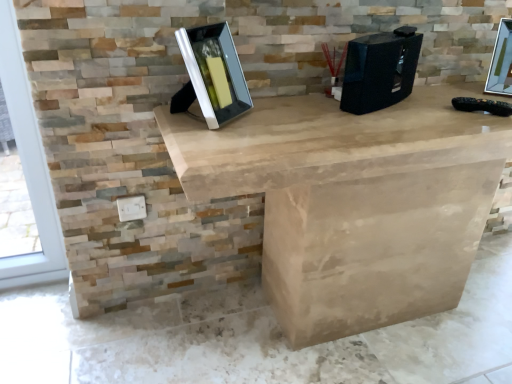
Question: Are metallic silver picture frame at upper right, the first picture frame when ordered from back to front, and matte black picture frame at center, which is counted as the first picture frame, starting from the left, far apart?

Choices:
 (A) no
 (B) yes

Answer: (A)

Question: Considering the relative sizes of metallic silver picture frame at upper right, the 2th picture frame viewed from the left, and matte black picture frame at center, which is the first picture frame from front to back, in the image provided, is metallic silver picture frame at upper right, the 2th picture frame viewed from the left, wider than matte black picture frame at center, which is the first picture frame from front to back,?

Choices:
 (A) yes
 (B) no

Answer: (B)

Question: Is metallic silver picture frame at upper right, which is the first picture frame from right to left, oriented away from matte black picture frame at center, which is counted as the first picture frame, starting from the left?

Choices:
 (A) no
 (B) yes

Answer: (A)

Question: Can you confirm if metallic silver picture frame at upper right, the first picture frame when ordered from back to front, is positioned to the left of matte black picture frame at center, which is counted as the first picture frame, starting from the left?

Choices:
 (A) yes
 (B) no

Answer: (B)

Question: Does metallic silver picture frame at upper right, which is the first picture frame from right to left, have a smaller size compared to matte black picture frame at center, which is the first picture frame from front to back?

Choices:
 (A) no
 (B) yes

Answer: (B)

Question: Is metallic silver picture frame at upper right, the 2th picture frame viewed from the left, facing towards matte black picture frame at center, which is the first picture frame from front to back?

Choices:
 (A) yes
 (B) no

Answer: (B)

Question: From the image's perspective, is matte black picture frame at center, positioned as the 2th picture frame in back-to-front order, on top of black plastic desktop computer at center?

Choices:
 (A) no
 (B) yes

Answer: (A)

Question: From a real-world perspective, is matte black picture frame at center, which is the first picture frame from front to back, physically below black plastic desktop computer at center?

Choices:
 (A) yes
 (B) no

Answer: (B)

Question: Considering the relative sizes of matte black picture frame at center, which ranks as the second picture frame in right-to-left order, and black plastic desktop computer at center in the image provided, is matte black picture frame at center, which ranks as the second picture frame in right-to-left order, taller than black plastic desktop computer at center?

Choices:
 (A) yes
 (B) no

Answer: (A)

Question: Can you confirm if matte black picture frame at center, which is the first picture frame from front to back, is wider than black plastic desktop computer at center?

Choices:
 (A) yes
 (B) no

Answer: (A)

Question: Is black plastic desktop computer at center at the back of matte black picture frame at center, which ranks as the second picture frame in right-to-left order?

Choices:
 (A) yes
 (B) no

Answer: (B)

Question: Is matte black picture frame at center, which is the first picture frame from front to back, at the right side of black plastic desktop computer at center?

Choices:
 (A) yes
 (B) no

Answer: (B)

Question: Considering the relative sizes of matte black picture frame at center, which ranks as the second picture frame in right-to-left order, and metallic silver picture frame at upper right, the first picture frame when ordered from back to front, in the image provided, is matte black picture frame at center, which ranks as the second picture frame in right-to-left order, shorter than metallic silver picture frame at upper right, the first picture frame when ordered from back to front,?

Choices:
 (A) no
 (B) yes

Answer: (A)